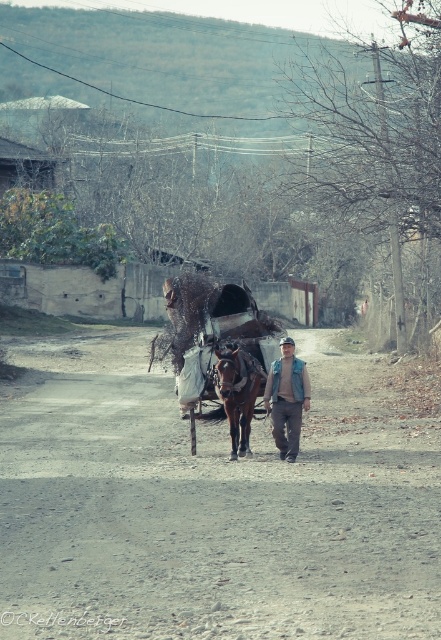
Question: Can you confirm if brown gravel dirt track at center is positioned below denim jacket at center?

Choices:
 (A) yes
 (B) no

Answer: (A)

Question: Which point is closer to the camera taking this photo?

Choices:
 (A) 189,294
 (B) 281,364

Answer: (B)

Question: Based on their relative distances, which object is nearer to the denim jacket at center?

Choices:
 (A) brown gravel dirt track at center
 (B) brown glossy horse at center
 (C) brown leather horse cart at center

Answer: (B)

Question: Can you confirm if brown leather horse cart at center is thinner than brown glossy horse at center?

Choices:
 (A) no
 (B) yes

Answer: (B)

Question: Among these points, which one is farthest from the camera?

Choices:
 (A) (175, 385)
 (B) (269, 444)

Answer: (A)

Question: In this image, where is brown gravel dirt track at center located relative to brown leather horse cart at center?

Choices:
 (A) right
 (B) left

Answer: (A)